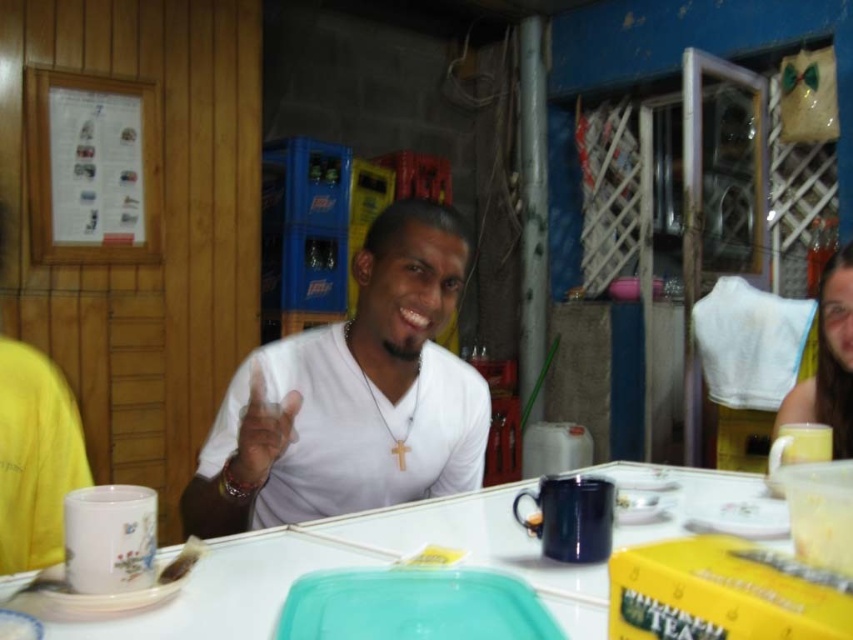
Question: Does white matte shirt at center come behind white glossy table at center?

Choices:
 (A) yes
 (B) no

Answer: (A)

Question: Is matte yellow mug at right below brown crumbly bread at lower center?

Choices:
 (A) yes
 (B) no

Answer: (B)

Question: Which point appears farthest from the camera in this image?

Choices:
 (A) (312, 536)
 (B) (831, 419)

Answer: (B)

Question: Is white matte shirt at center further to the viewer compared to white glossy table at center?

Choices:
 (A) yes
 (B) no

Answer: (A)

Question: Which point is closer to the camera?

Choices:
 (A) (215, 470)
 (B) (280, 529)
 (C) (195, 556)

Answer: (C)

Question: Among these points, which one is farthest from the camera?

Choices:
 (A) (202, 552)
 (B) (815, 394)
 (C) (218, 451)
 (D) (194, 611)

Answer: (B)